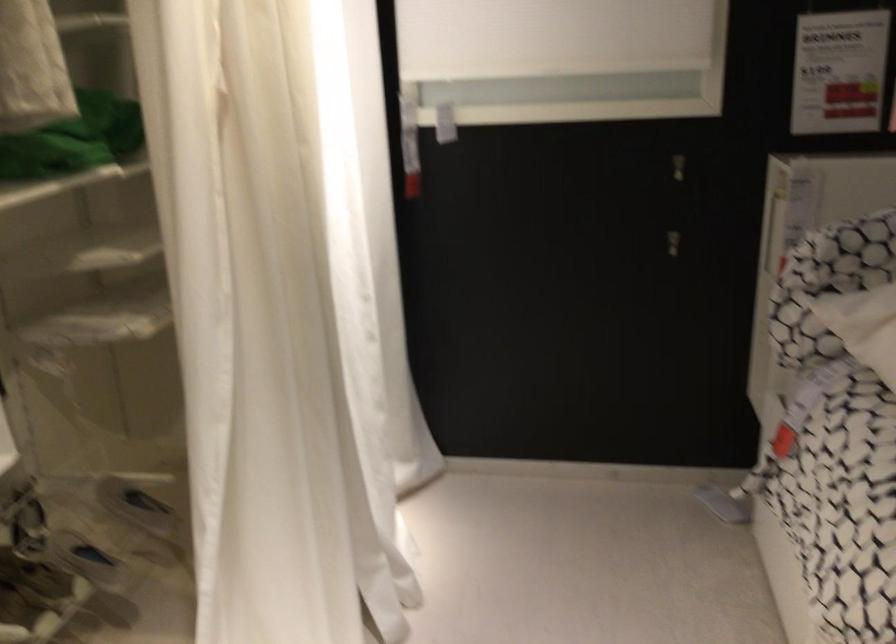
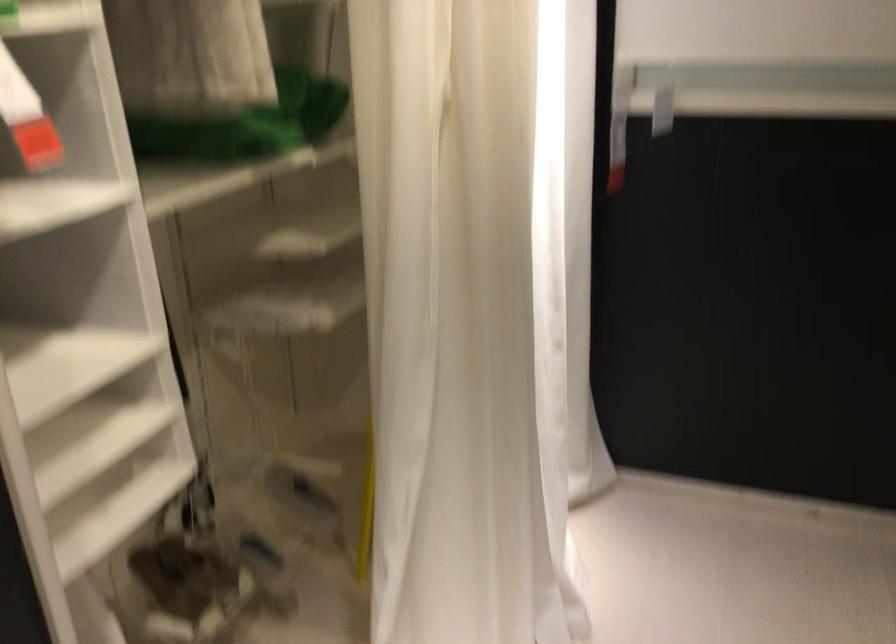
Question: The camera is either moving clockwise (left) or counter-clockwise (right) around the object. The first image is from the beginning of the video and the second image is from the end. Is the camera moving left or right when shooting the video?

Choices:
 (A) Left
 (B) Right

Answer: (B)